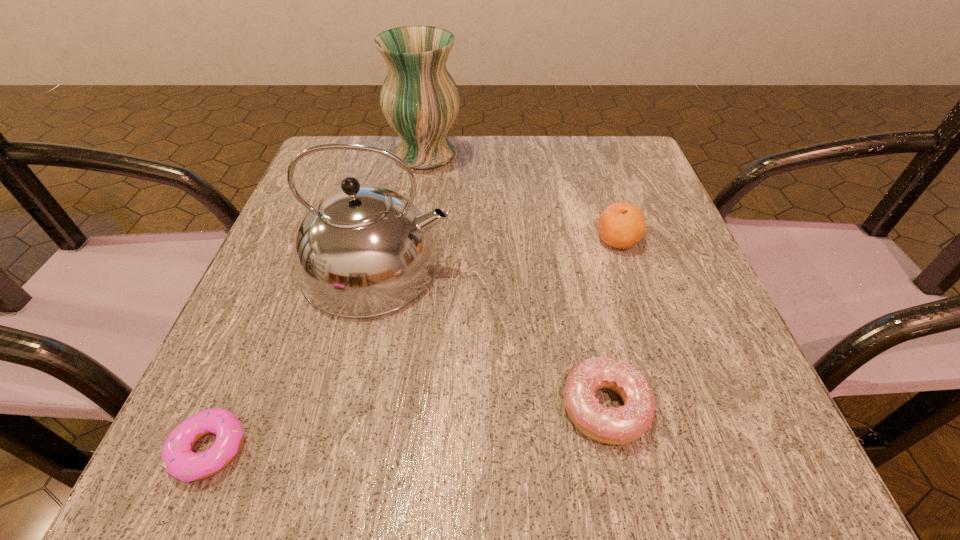
In the image, there is a desktop. Where is `vacant space at the near edge`? Image resolution: width=960 pixels, height=540 pixels. vacant space at the near edge is located at coordinates (390, 441).

The image size is (960, 540). Identify the location of vacant space at the left edge of the desktop. (232, 361).

Image resolution: width=960 pixels, height=540 pixels. Identify the location of vacant area at the right edge of the desktop. (616, 286).

Identify the location of free location at the far left corner of the desktop. (338, 143).

You are a GUI agent. You are given a task and a screenshot of the screen. Output one action in this format:
    pyautogui.click(x=<x>, y=<y>)
    Task: Click on the vacant area at the far right corner
    
    Given the screenshot: What is the action you would take?
    pyautogui.click(x=612, y=173)

In the image, there is a desktop. At what (x,y) coordinates should I click in order to perform the action: click on vacant space at the near right corner. Please return your answer as a coordinate pair (x, y). The width and height of the screenshot is (960, 540). Looking at the image, I should click on (718, 451).

Locate an element on the screen. This screenshot has height=540, width=960. unoccupied position between the left doughnut and the fourth tallest object is located at coordinates (407, 428).

You are a GUI agent. You are given a task and a screenshot of the screen. Output one action in this format:
    pyautogui.click(x=<x>, y=<y>)
    Task: Click on the free space that is in between the shorter doughnut and the taller doughnut
    Image resolution: width=960 pixels, height=540 pixels.
    Given the screenshot: What is the action you would take?
    pyautogui.click(x=407, y=428)

Locate an element on the screen. Image resolution: width=960 pixels, height=540 pixels. empty location between the shortest object and the second shortest object is located at coordinates (407, 428).

The width and height of the screenshot is (960, 540). Find the location of `vacant region between the third shortest object and the kettle`. vacant region between the third shortest object and the kettle is located at coordinates (497, 253).